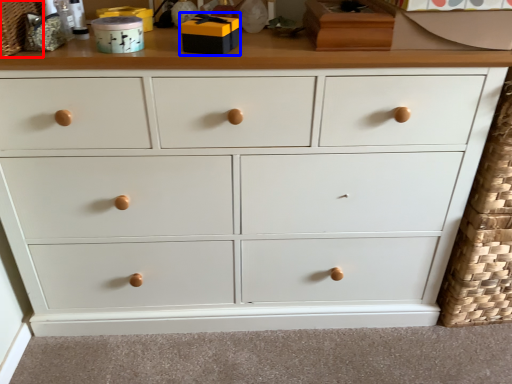
Question: Which of the following is the closest to the observer, basket (highlighted by a red box) or toy (highlighted by a blue box)?

Choices:
 (A) basket
 (B) toy

Answer: (A)